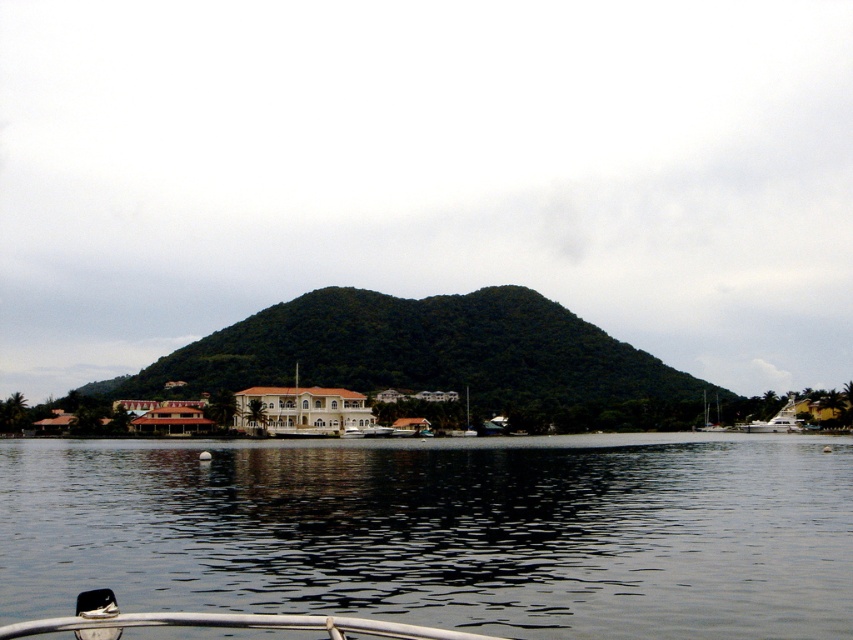
You are standing on the dock near the transparent water at center and want to reach the white glossy sailboat at lower right. Which direction should you move to get closer to the sailboat?

Since the transparent water at center is closer to the viewer than the white glossy sailboat at lower right, you should move away from the water towards the lower right direction to reach the sailboat.

Based on the scene description, where is the transparent water at center located in the image?

The transparent water at center is located at point coordinates of 0.833 on the x axis and 0.518 on the y axis.

You are a photographer planning to capture the waterfront scene. You want to ensure that both the transparent water at center and the green leafy mountain at center are clearly visible in your shot. Which object should you focus on first to ensure both are in frame?

The transparent water at center is smaller than the green leafy mountain at center, so you should focus on the green leafy mountain at center first to ensure both are in frame.